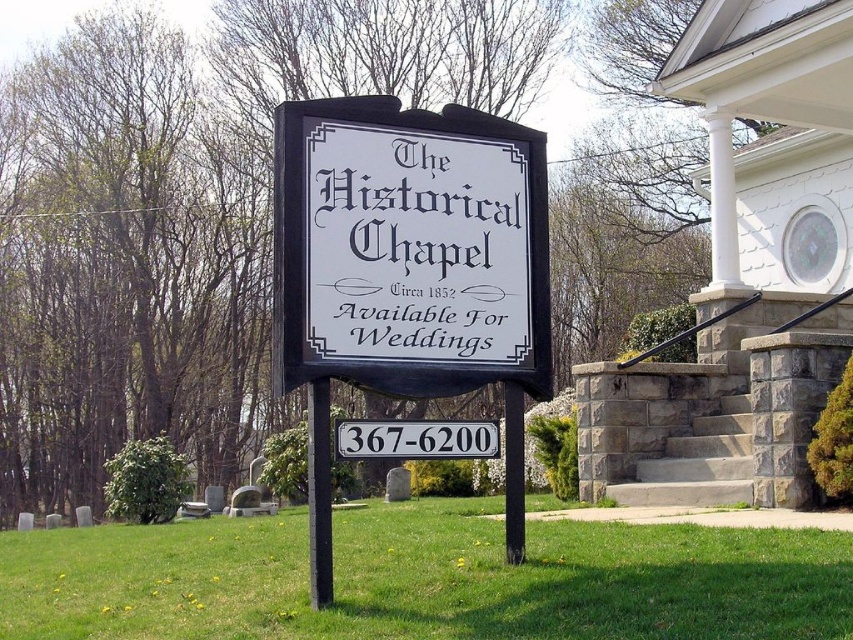
Where is `white matte sign at center`? The width and height of the screenshot is (853, 640). white matte sign at center is located at coordinates (409, 248).

Can you confirm if white matte sign at center is positioned to the left of black metal pole at center?

Incorrect, white matte sign at center is not on the left side of black metal pole at center.

Identify the location of white matte sign at center. The width and height of the screenshot is (853, 640). pyautogui.click(x=409, y=248).

I want to click on white matte sign at center, so click(409, 248).

Does black paper sign at center appear on the right side of black plastic pole at center?

In fact, black paper sign at center is to the left of black plastic pole at center.

Is black paper sign at center positioned behind black plastic pole at center?

No, it is in front of black plastic pole at center.

At what (x,y) coordinates should I click in order to perform the action: click on black paper sign at center. Please return your answer as a coordinate pair (x, y). Looking at the image, I should click on 415,246.

Between black paper sign at center and black metal pole at center, which one has more height?

black paper sign at center

Can you confirm if black paper sign at center is positioned above black metal pole at center?

Yes.

Which is in front, point (434, 182) or point (317, 593)?

Positioned in front is point (317, 593).

This screenshot has width=853, height=640. I want to click on black paper sign at center, so click(415, 246).